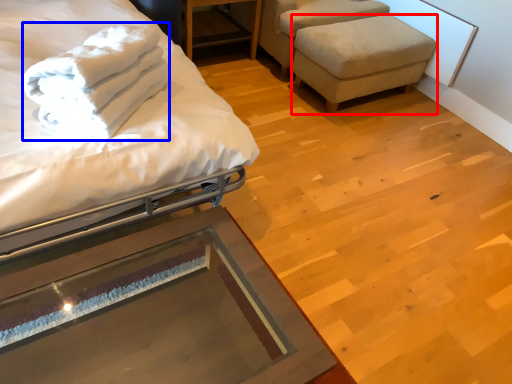
Question: Which point is further to the camera, stool (highlighted by a red box) or bath towel (highlighted by a blue box)?

Choices:
 (A) stool
 (B) bath towel

Answer: (A)